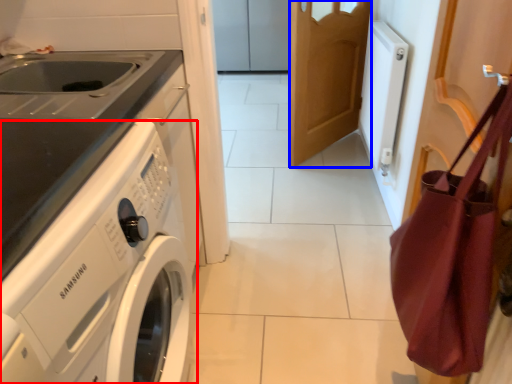
Question: Which of the following is the closest to the observer, washing machine (highlighted by a red box) or door (highlighted by a blue box)?

Choices:
 (A) washing machine
 (B) door

Answer: (A)